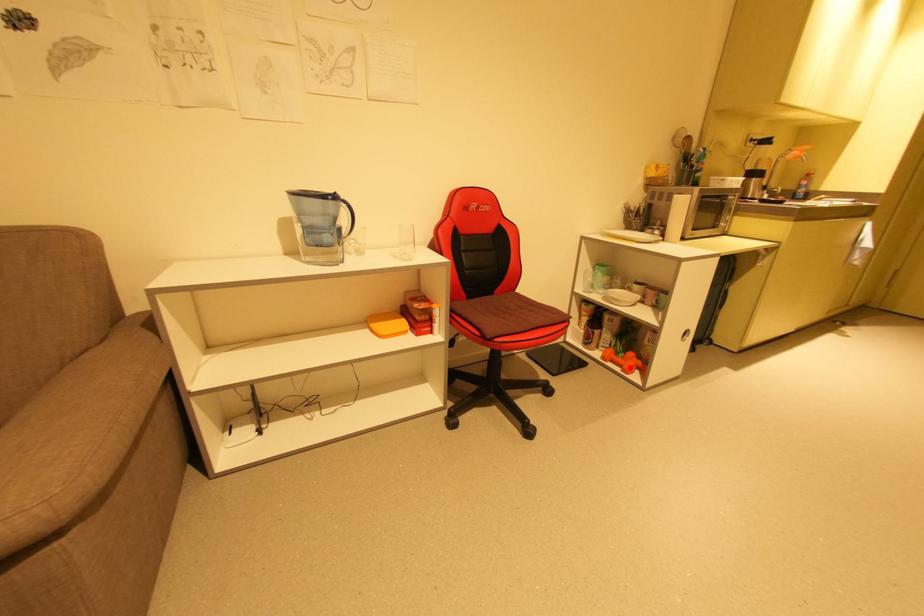
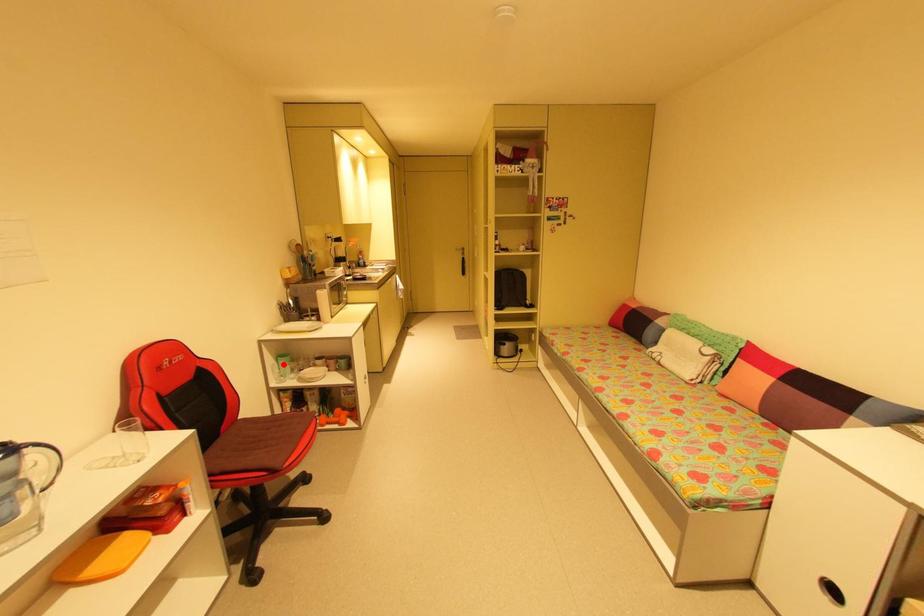
I am providing you with two images of the same scene from different viewpoints. A red point is marked on the first image and another point is marked on the second image. Are the points marked in image1 and image2 representing the same 3D position?

No